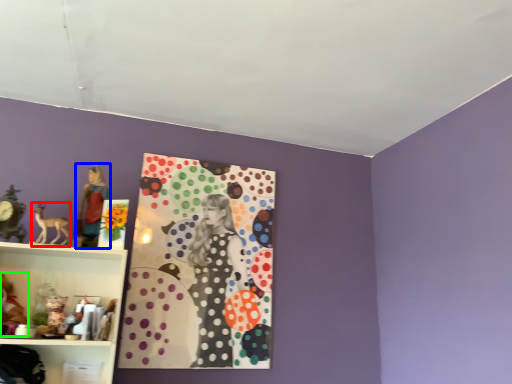
Question: Based on their relative distances, which object is nearer to animal (highlighted by a red box)? Choose from person (highlighted by a blue box) and toy (highlighted by a green box).

Choices:
 (A) person
 (B) toy

Answer: (A)